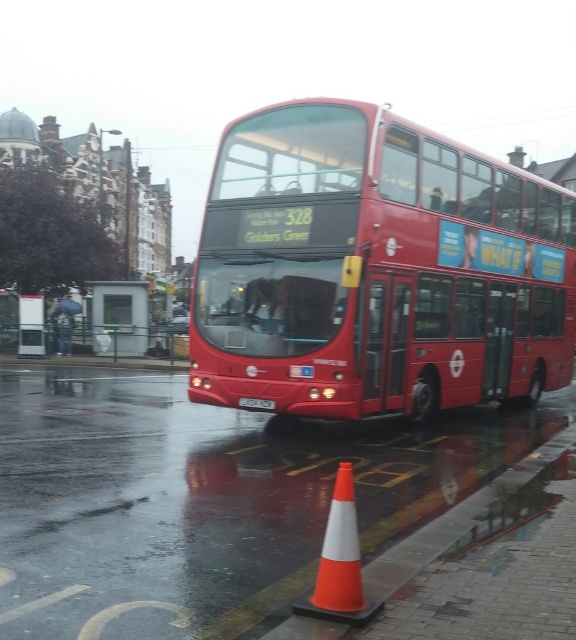
You are a pedestrian standing in front of the red double decker bus. You need to locate both the metallic silver bus stop at center and the white plastic license plate at center. Which one is positioned higher relative to the ground?

The metallic silver bus stop at center is above the white plastic license plate at center, so the metallic silver bus stop at center is positioned higher relative to the ground.

In the scene shown: You are a pedestrian standing at point A, which is located at coordinates (376,269). You want to cross the road to reach the traffic cone on the sidewalk. Is there a clear path to walk from your current position to the traffic cone without going near the shiny red bus at center?

The point at (376,269) is where the shiny red bus at center is located, so you cannot walk there as it is occupied by the bus.